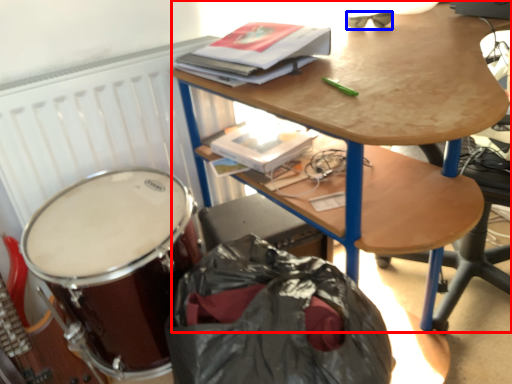
Question: Which point is closer to the camera, desk (highlighted by a red box) or glasses (highlighted by a blue box)?

Choices:
 (A) desk
 (B) glasses

Answer: (A)